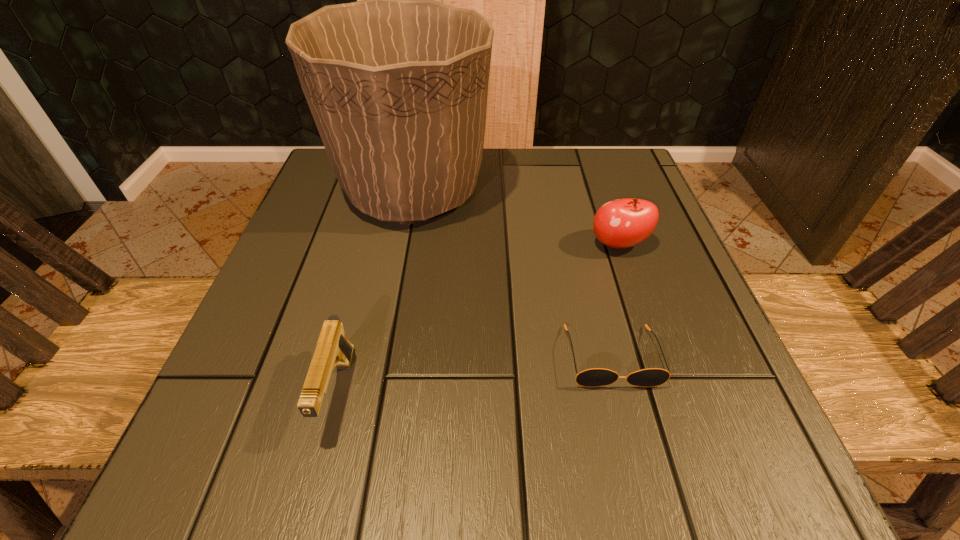
Find the location of a particular element. The image size is (960, 540). vacant space that is in between the second tallest object and the flowerpot is located at coordinates (516, 218).

The width and height of the screenshot is (960, 540). Identify the location of free space that is in between the sunglasses and the tallest object. (512, 274).

Where is `free space between the second shortest object and the sunglasses`? free space between the second shortest object and the sunglasses is located at coordinates (474, 375).

This screenshot has width=960, height=540. Identify the location of free area in between the shortest object and the pistol. (474, 375).

Locate an element on the screen. The height and width of the screenshot is (540, 960). free space that is in between the second shortest object and the sunglasses is located at coordinates (474, 375).

Image resolution: width=960 pixels, height=540 pixels. Find the location of `free space between the apple and the flowerpot`. free space between the apple and the flowerpot is located at coordinates (516, 218).

Find the location of a particular element. The width and height of the screenshot is (960, 540). free space between the tallest object and the apple is located at coordinates (516, 218).

The image size is (960, 540). I want to click on empty space that is in between the third shortest object and the flowerpot, so click(x=516, y=218).

The width and height of the screenshot is (960, 540). In order to click on vacant space that's between the tallest object and the apple in this screenshot , I will do `click(516, 218)`.

Locate an element on the screen. vacant point located between the third shortest object and the sunglasses is located at coordinates (615, 301).